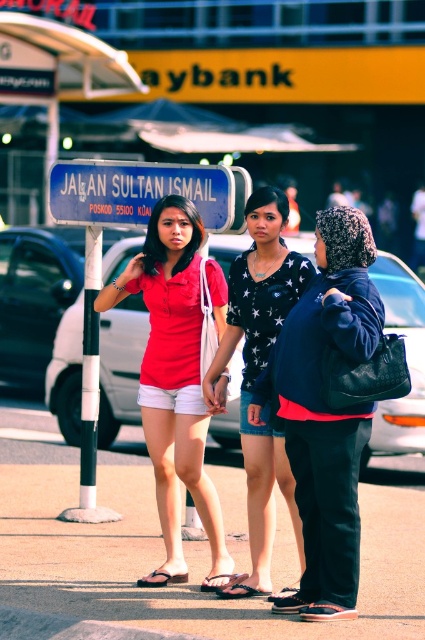
Question: Which object is closer to the camera taking this photo?

Choices:
 (A) black glossy pole at center
 (B) denim shorts at center
 (C) black leather jacket at center
 (D) matte red shirt at center

Answer: (C)

Question: Is matte red shirt at center to the left of blue plastic sign at upper center from the viewer's perspective?

Choices:
 (A) no
 (B) yes

Answer: (A)

Question: Which of these objects is positioned closest to the blue plastic sign at upper center?

Choices:
 (A) black glossy pole at center
 (B) black leather jacket at center
 (C) matte red shirt at center

Answer: (A)

Question: Does black leather jacket at center lie behind blue plastic sign at upper center?

Choices:
 (A) no
 (B) yes

Answer: (A)

Question: Estimate the real-world distances between objects in this image. Which object is closer to the denim shorts at center?

Choices:
 (A) black leather jacket at center
 (B) black glossy pole at center
 (C) blue plastic sign at upper center
 (D) matte red shirt at center

Answer: (A)

Question: Is black leather jacket at center above black glossy pole at center?

Choices:
 (A) yes
 (B) no

Answer: (B)